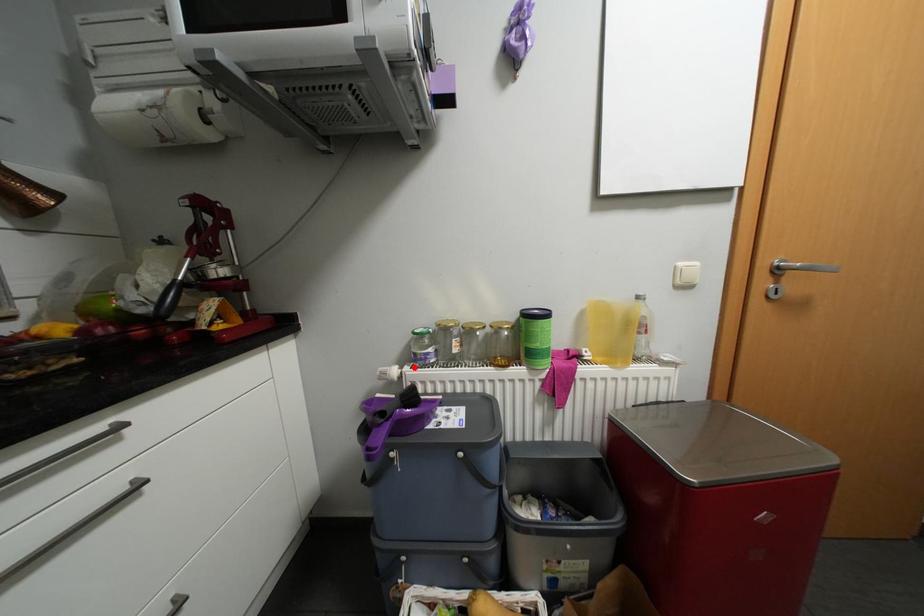
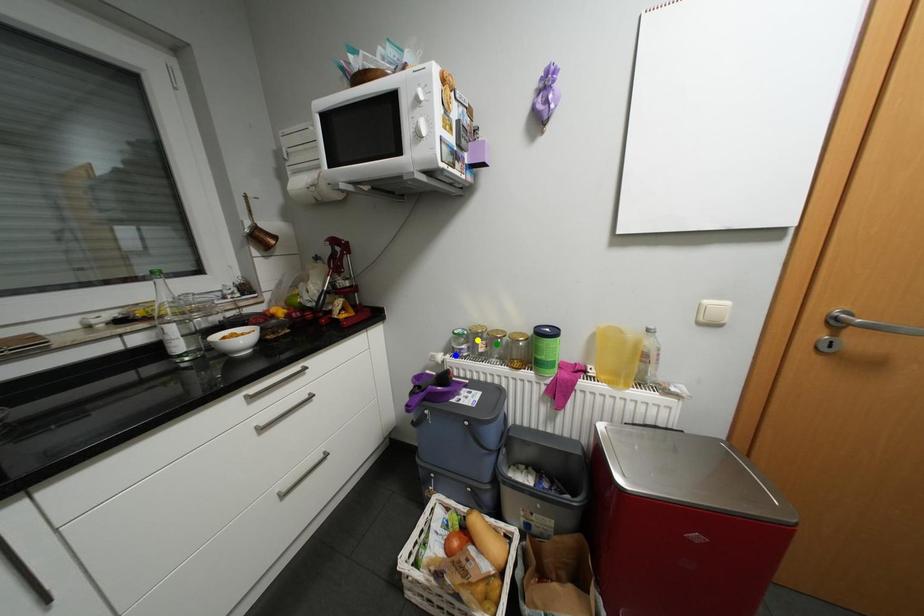
Question: I am providing you with two images of the same scene from different viewpoints. A red point is marked on the first image. You are given multiple points on the second image. Which spot in image 2 lines up with the point in image 1?

Choices:
 (A) yellow point
 (B) green point
 (C) blue point

Answer: (C)